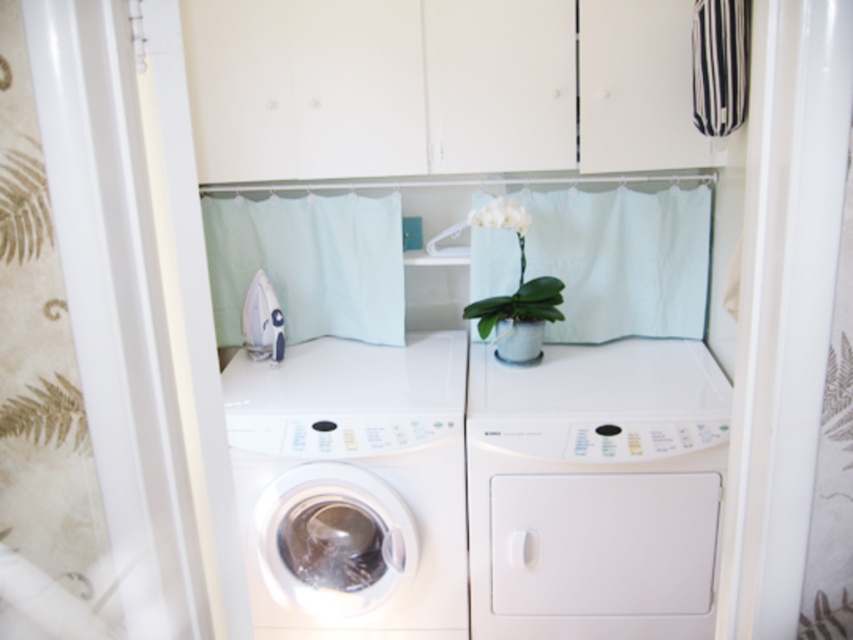
Question: Does light blue fabric curtain at center have a lesser width compared to white matte flower at center?

Choices:
 (A) no
 (B) yes

Answer: (A)

Question: Which point is closer to the camera taking this photo?

Choices:
 (A) (482, 294)
 (B) (302, 388)
 (C) (524, 212)
 (D) (563, 388)

Answer: (D)

Question: Based on their relative distances, which object is farther from the light blue fabric curtain at center?

Choices:
 (A) white matte/texture dryer at center
 (B) black striped curtain at upper right
 (C) white glossy washing machine at center
 (D) matte white vase at center

Answer: (B)

Question: Which point is farther from the camera taking this photo?

Choices:
 (A) (726, 116)
 (B) (521, 348)
 (C) (618, 554)

Answer: (B)

Question: Can you confirm if white glossy washing machine at center is positioned to the left of light blue fabric curtain at center?

Choices:
 (A) yes
 (B) no

Answer: (B)

Question: Can you confirm if white glossy washing machine at center is wider than white matte flower at center?

Choices:
 (A) yes
 (B) no

Answer: (A)